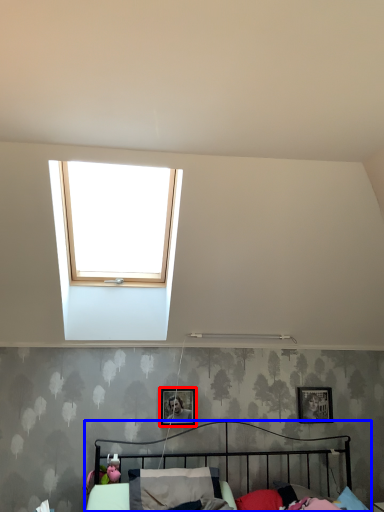
Question: Which object is further to the camera taking this photo, picture frame (highlighted by a red box) or bed (highlighted by a blue box)?

Choices:
 (A) picture frame
 (B) bed

Answer: (A)